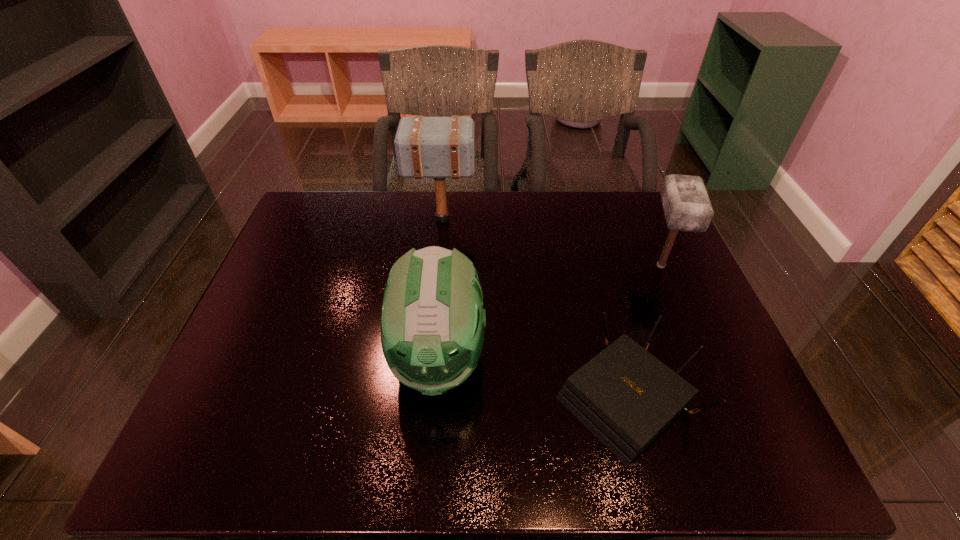
Where is `vacant space at the far right corner of the desktop`? vacant space at the far right corner of the desktop is located at coordinates (653, 228).

You are a GUI agent. You are given a task and a screenshot of the screen. Output one action in this format:
    pyautogui.click(x=<x>, y=<y>)
    Task: Click on the free space between the shortest object and the nearer mallet
    The image size is (960, 540).
    Given the screenshot: What is the action you would take?
    pyautogui.click(x=642, y=332)

Where is `vacant area that lies between the second farthest object and the football helmet`? vacant area that lies between the second farthest object and the football helmet is located at coordinates (549, 312).

Image resolution: width=960 pixels, height=540 pixels. Identify the location of vacant area between the shortest object and the football helmet. (532, 378).

This screenshot has width=960, height=540. Identify the location of empty space between the second farthest object and the football helmet. (549, 312).

Locate an element on the screen. The width and height of the screenshot is (960, 540). free space between the football helmet and the shortest object is located at coordinates (532, 378).

Image resolution: width=960 pixels, height=540 pixels. I want to click on free space between the farther mallet and the right mallet, so click(x=551, y=242).

Image resolution: width=960 pixels, height=540 pixels. Identify the location of free space between the router and the right mallet. (642, 332).

The height and width of the screenshot is (540, 960). Find the location of `vacant space in between the shortest object and the farther mallet`. vacant space in between the shortest object and the farther mallet is located at coordinates (533, 308).

Locate which object is the closest to the router. Please provide its 2D coordinates. Your answer should be formatted as a tuple, i.e. [(x, y)], where the tuple contains the x and y coordinates of a point satisfying the conditions above.

[(432, 325)]